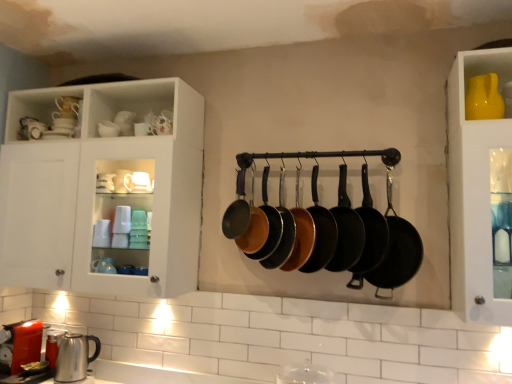
Question: Is point (71, 163) closer or farther from the camera than point (376, 221)?

Choices:
 (A) farther
 (B) closer

Answer: (A)

Question: Looking at their shapes, would you say white glossy cabinet at upper left is wider or thinner than black non-stick frying pan at center, the second frying pan when ordered from right to left?

Choices:
 (A) thin
 (B) wide

Answer: (B)

Question: Estimate the real-world distances between objects in this image. Which object is farther from the matte black frying pan at center, which appears as the 4th frying pan when viewed from the left?

Choices:
 (A) matte black frying pan at center, the fifth frying pan in the left-to-right sequence
 (B) black cast iron frying pan at center, which is the 8th frying pan in left-to-right order
 (C) yellow glossy vase at upper right
 (D) black non-stick frying pan at center, the 7th frying pan from the left
 (E) matte black frying pan at center, arranged as the 6th frying pan when viewed from the left

Answer: (C)

Question: Considering the real-world distances, which object is closest to the matte orange frying pan at center, which is counted as the 7th frying pan, starting from the right?

Choices:
 (A) matte black frying pan at center, acting as the 4th frying pan starting from the right
 (B) black cast iron frying pan at center, which is the 8th frying pan in left-to-right order
 (C) satin silver kettle at lower left
 (D) matte black frying pan at center, the fifth frying pan positioned from the right
 (E) matte black frying pan at center, which is counted as the 3th frying pan, starting from the right

Answer: (D)